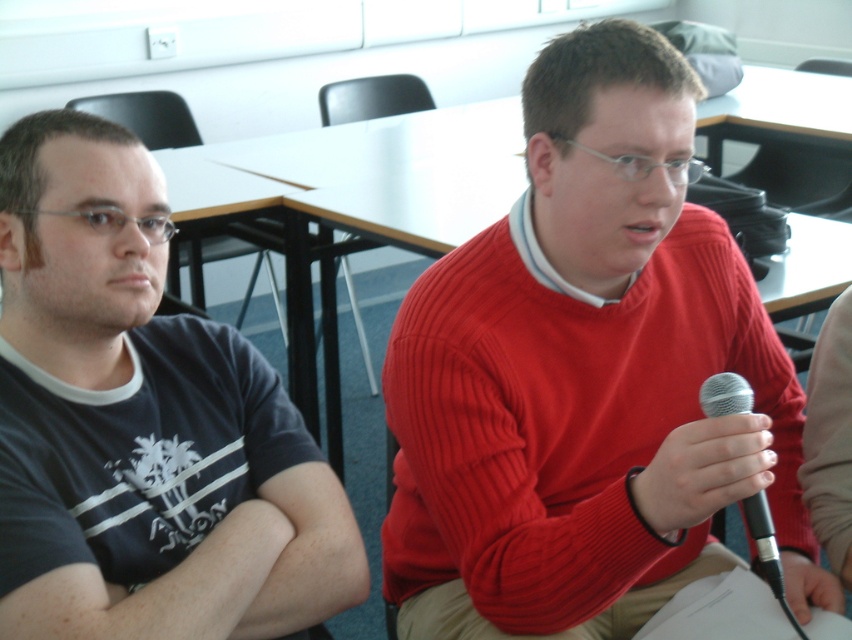
Can you confirm if red ribbed sweater at center is smaller than dark blue t-shirt at left?

No, red ribbed sweater at center is not smaller than dark blue t-shirt at left.

This screenshot has width=852, height=640. Describe the element at coordinates (586, 376) in the screenshot. I see `red ribbed sweater at center` at that location.

Image resolution: width=852 pixels, height=640 pixels. Find the location of `red ribbed sweater at center`. red ribbed sweater at center is located at coordinates click(x=586, y=376).

Can you confirm if dark blue t-shirt at left is thinner than silver metallic microphone at center?

In fact, dark blue t-shirt at left might be wider than silver metallic microphone at center.

Is point (95, 339) positioned behind point (760, 563)?

Yes.

I want to click on dark blue t-shirt at left, so click(x=141, y=422).

Who is shorter, red ribbed sweater at center or silver metallic microphone at center?

With less height is silver metallic microphone at center.

This screenshot has height=640, width=852. What do you see at coordinates (586, 376) in the screenshot? I see `red ribbed sweater at center` at bounding box center [586, 376].

Is point (445, 326) positioned before point (761, 573)?

That is True.

Locate an element on the screen. The height and width of the screenshot is (640, 852). red ribbed sweater at center is located at coordinates (586, 376).